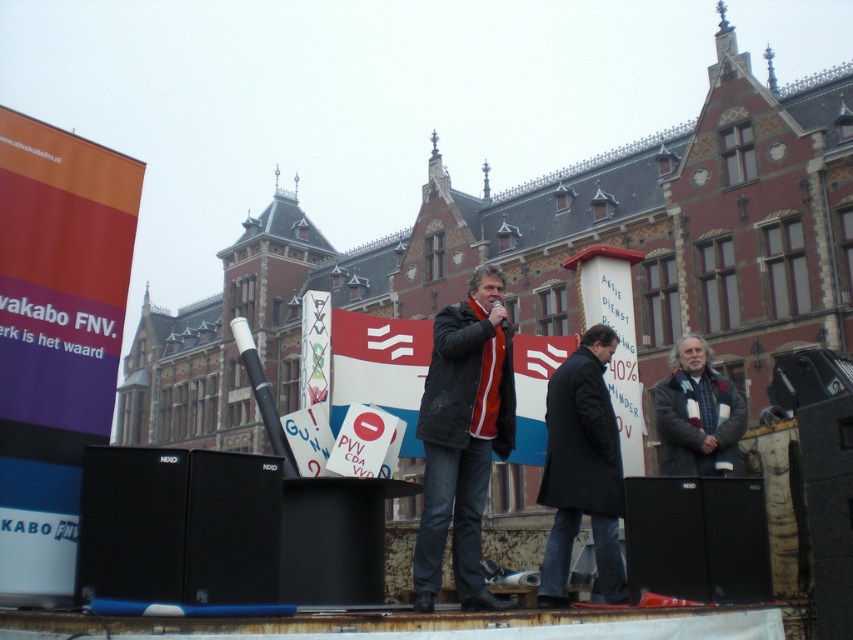
Question: Which point is farther to the camera?

Choices:
 (A) (756, 506)
 (B) (550, 451)
 (C) (706, 554)
 (D) (509, 371)

Answer: (D)

Question: Among these points, which one is farthest from the camera?

Choices:
 (A) (178, 547)
 (B) (705, 492)
 (C) (548, 380)

Answer: (C)

Question: Which point appears closest to the camera in this image?

Choices:
 (A) (148, 508)
 (B) (654, 582)
 (C) (463, 394)

Answer: (A)

Question: Is matte black speaker at center thinner than black matte speaker at lower right?

Choices:
 (A) yes
 (B) no

Answer: (B)

Question: In this image, where is matte black speaker at center located relative to gray woolen coat at right?

Choices:
 (A) right
 (B) left

Answer: (B)

Question: Can you confirm if black wool coat at center is wider than matte black speaker at center?

Choices:
 (A) yes
 (B) no

Answer: (A)